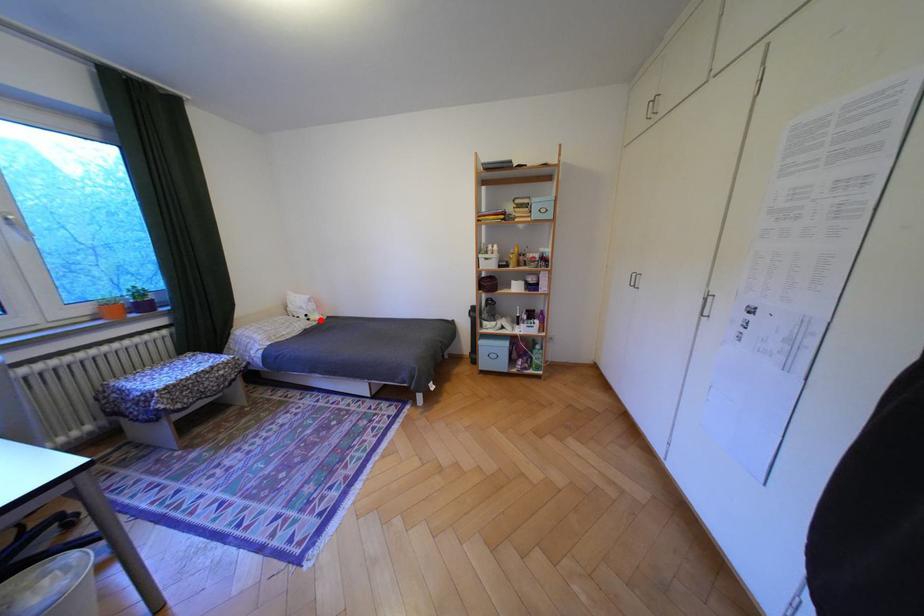
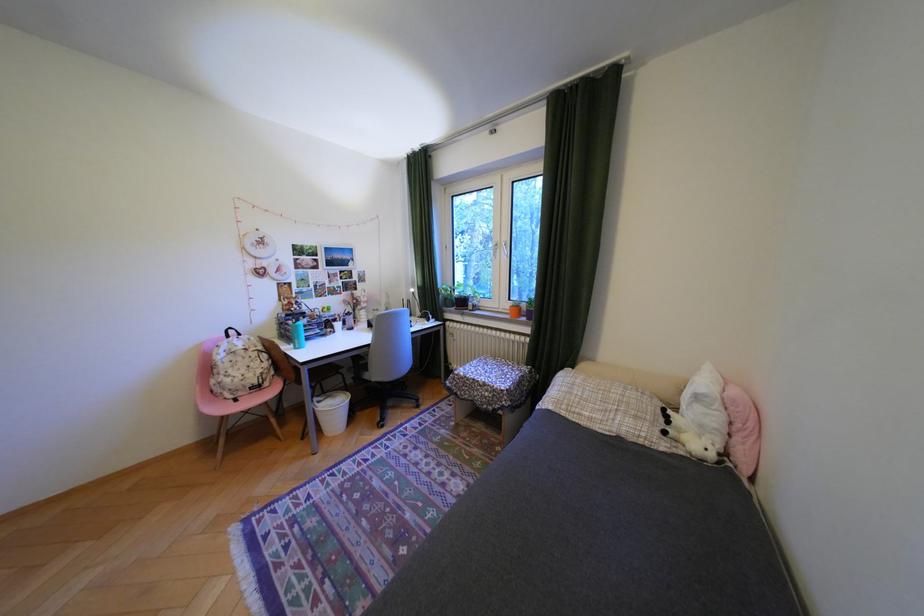
Question: I am providing you with two images of the same scene from different viewpoints. A red point is shown in image1. For the corresponding object point in image2, is it positioned nearer or farther from the camera?

Choices:
 (A) Nearer
 (B) Farther

Answer: (B)